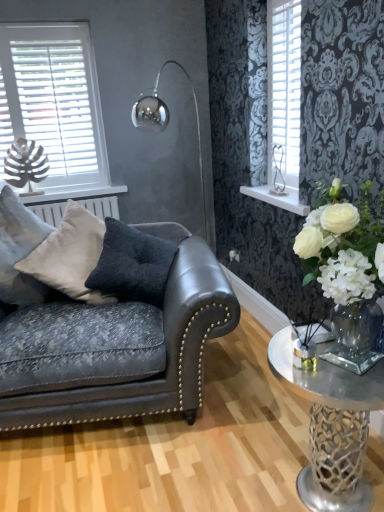
Locate an element on the screen. free region under clear glass vase at right (from a real-world perspective) is located at coordinates (317, 492).